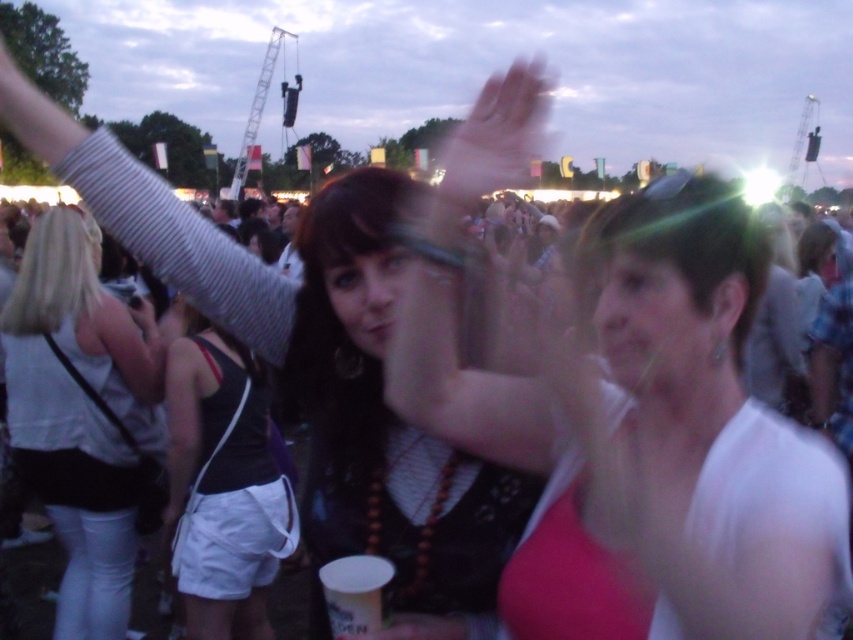
Question: From the image, what is the correct spatial relationship of white matte shirt at center in relation to white matte tank top at upper left?

Choices:
 (A) left
 (B) right

Answer: (B)

Question: Is black fabric tank top at center positioned at the back of translucent plastic hand at upper center?

Choices:
 (A) yes
 (B) no

Answer: (A)

Question: Among these points, which one is nearest to the camera?

Choices:
 (A) (647, 234)
 (B) (474, 147)
 (C) (216, 531)

Answer: (A)

Question: Which of the following is the farthest from the observer?

Choices:
 (A) (39, 445)
 (B) (495, 104)

Answer: (A)

Question: Which point is farther to the camera?

Choices:
 (A) white matte shirt at center
 (B) black fabric tank top at center
 (C) translucent plastic hand at upper center

Answer: (B)

Question: Can you confirm if white matte tank top at upper left is smaller than black fabric tank top at center?

Choices:
 (A) no
 (B) yes

Answer: (A)